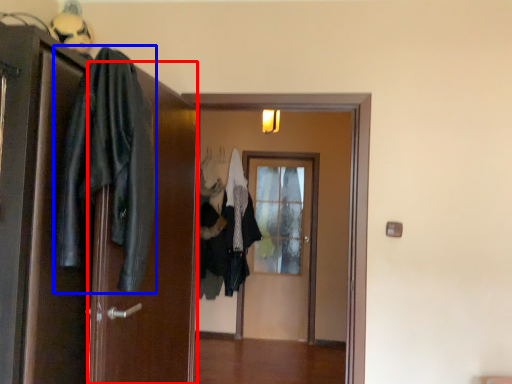
Question: Which object is closer to the camera taking this photo, screen door (highlighted by a red box) or clothing (highlighted by a blue box)?

Choices:
 (A) screen door
 (B) clothing

Answer: (B)